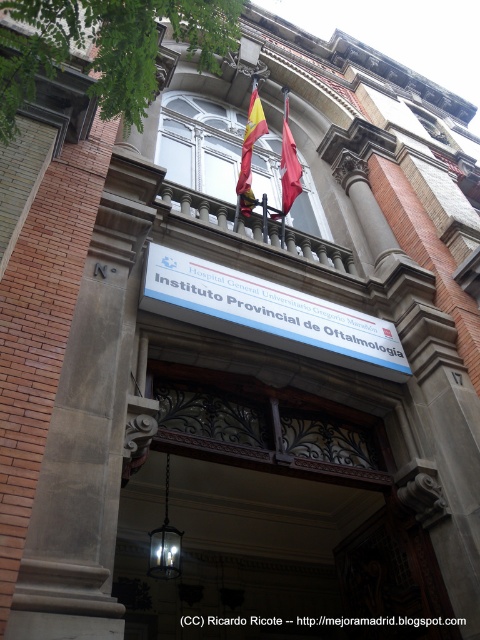
Question: Can you confirm if brown stone pillar at center is positioned below red fabric flag at center?

Choices:
 (A) no
 (B) yes

Answer: (B)

Question: Based on their relative distances, which object is farther from the brown stone pillar at center?

Choices:
 (A) dark brown wooden door at center
 (B) red fabric flag at center
 (C) polished wood balcony at upper center
 (D) red fabric flag at upper center

Answer: (C)

Question: Which point appears closest to the camera in this image?

Choices:
 (A) (288, 150)
 (B) (136, 637)

Answer: (B)

Question: Is polished wood balcony at upper center to the left of red fabric flag at center from the viewer's perspective?

Choices:
 (A) no
 (B) yes

Answer: (A)

Question: Which point is closer to the camera taking this photo?

Choices:
 (A) (274, 241)
 (B) (249, 154)

Answer: (A)

Question: Is dark brown wooden door at center bigger than white plastic sign at center?

Choices:
 (A) yes
 (B) no

Answer: (A)